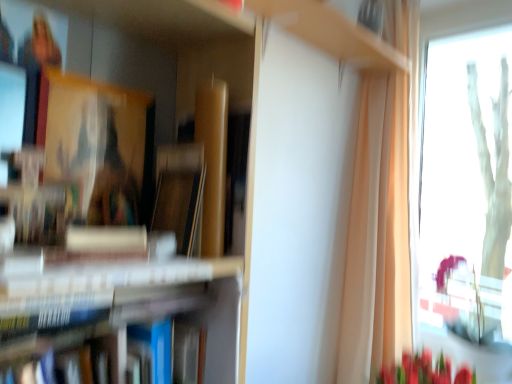
Question: From the image's perspective, is transparent glass window at right positioned above or below wooden cabinet at upper center?

Choices:
 (A) above
 (B) below

Answer: (B)

Question: Looking at the image, does transparent glass window at right seem bigger or smaller compared to wooden cabinet at upper center?

Choices:
 (A) big
 (B) small

Answer: (A)

Question: Estimate the real-world distances between objects in this image. Which object is closer to the wooden cabinet at upper center?

Choices:
 (A) transparent glass window at right
 (B) hardcover books at left

Answer: (B)

Question: Which object is positioned farthest from the hardcover books at left?

Choices:
 (A) transparent glass window at right
 (B) wooden cabinet at upper center

Answer: (A)